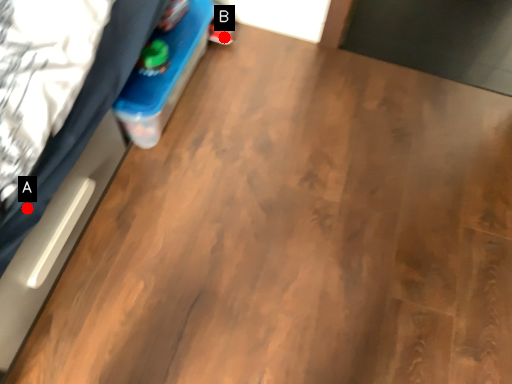
Question: Two points are circled on the image, labeled by A and B beside each circle. Which point is closer to the camera?

Choices:
 (A) A is closer
 (B) B is closer

Answer: (A)